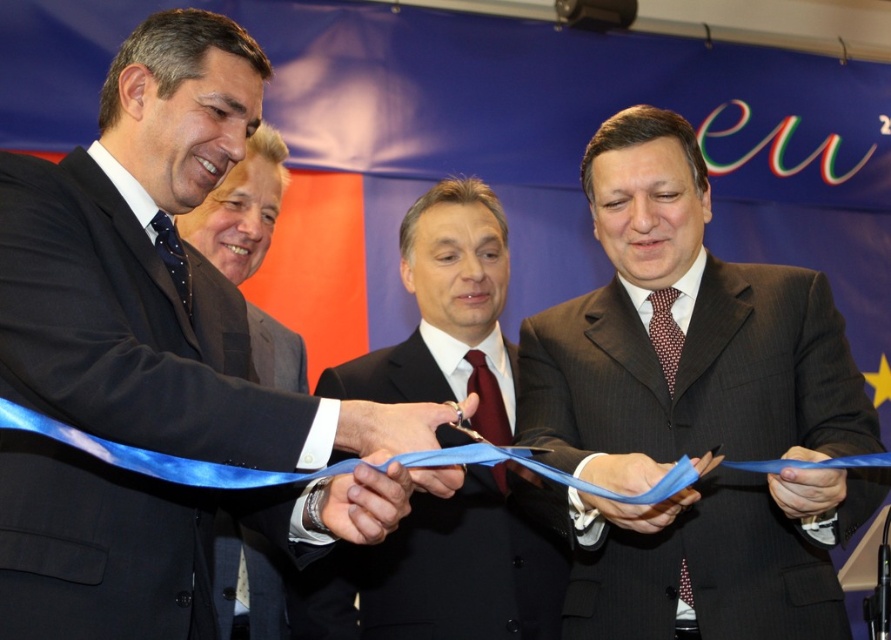
You are a photographer at the event and need to ensure the dark brown suit at center and the blue fabric ribbon at lower center are both in focus. Which object should you adjust your camera focus to first to ensure proper depth of field?

The dark brown suit at center is taller than the blue fabric ribbon at lower center, so you should focus on the dark brown suit at center first to ensure proper depth of field.